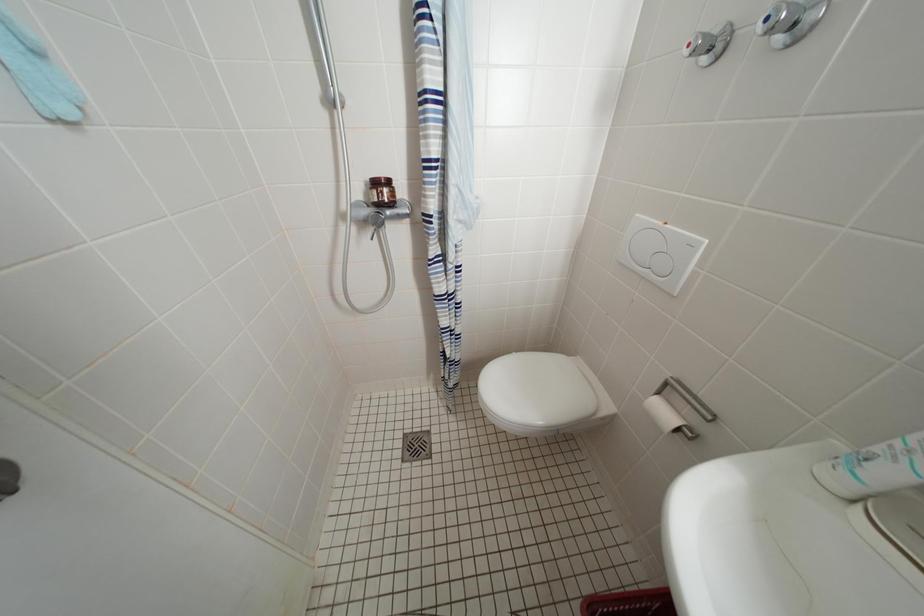
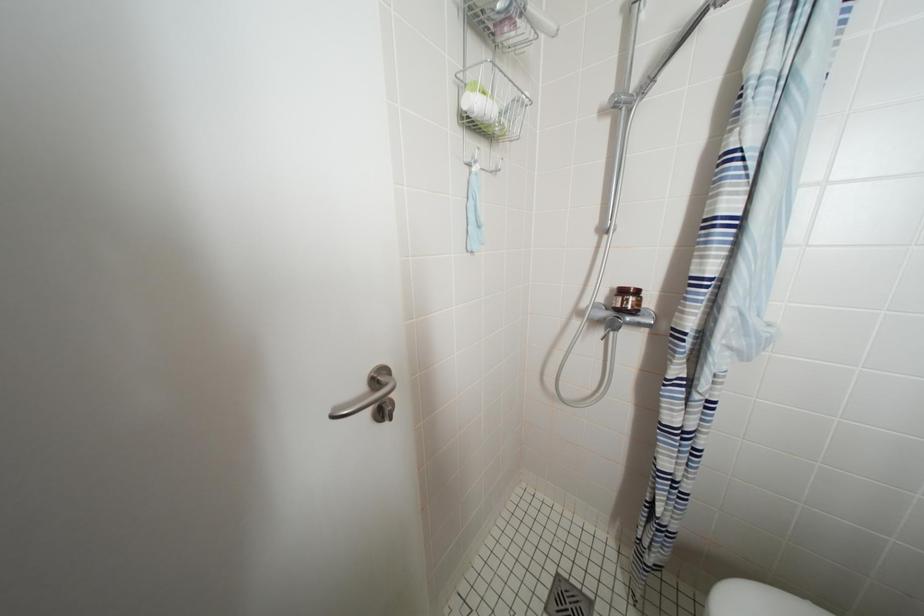
Question: The camera is either moving clockwise (left) or counter-clockwise (right) around the object. The first image is from the beginning of the video and the second image is from the end. Is the camera moving left or right when shooting the video?

Choices:
 (A) Left
 (B) Right

Answer: (B)